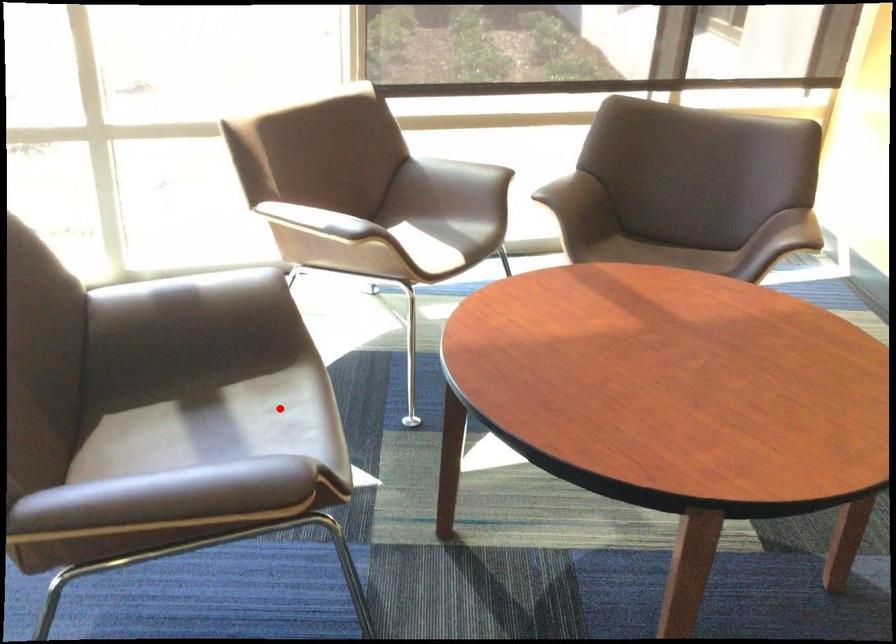
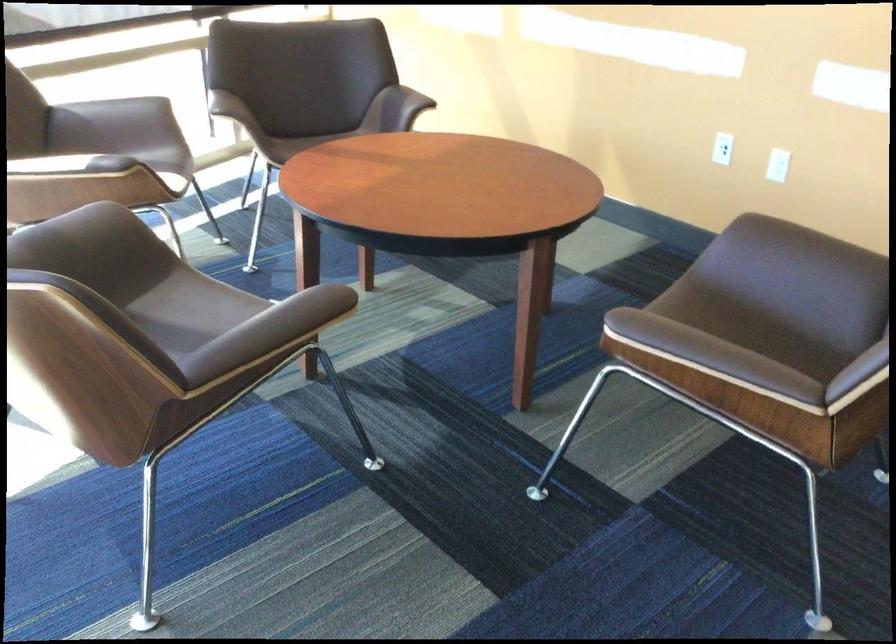
Find the pixel in the second image that matches the highlighted location in the first image.

(191, 310)